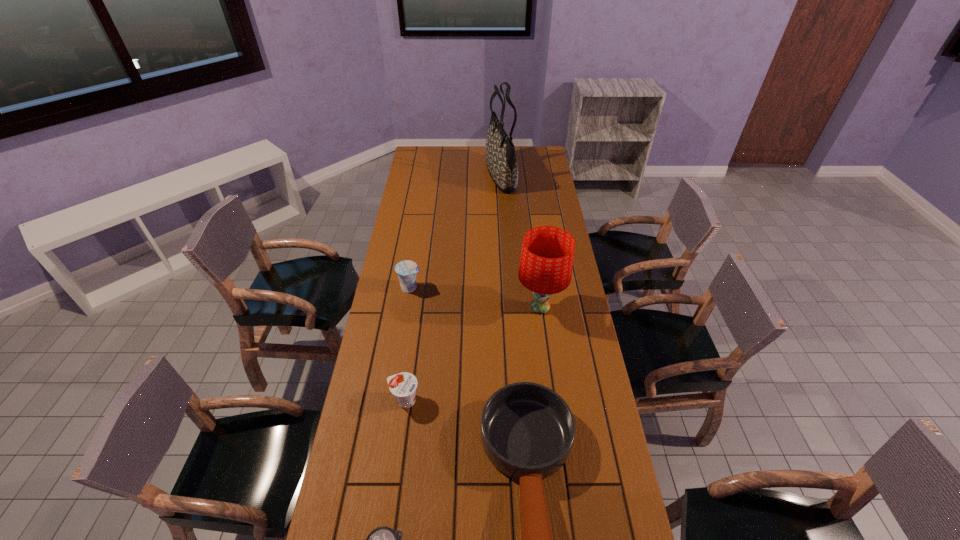
Identify which object is the closest to the tallest object. Please provide its 2D coordinates. Your answer should be formatted as a tuple, i.e. [(x, y)], where the tuple contains the x and y coordinates of a point satisfying the conditions above.

[(406, 270)]

Find the location of `the second closest object to the second tallest object`. the second closest object to the second tallest object is located at coordinates (406, 270).

Find the location of `the closest yogurt relative to the shortest object`. the closest yogurt relative to the shortest object is located at coordinates (403, 385).

This screenshot has width=960, height=540. I want to click on the second closest yogurt to the second farthest yogurt, so click(x=406, y=270).